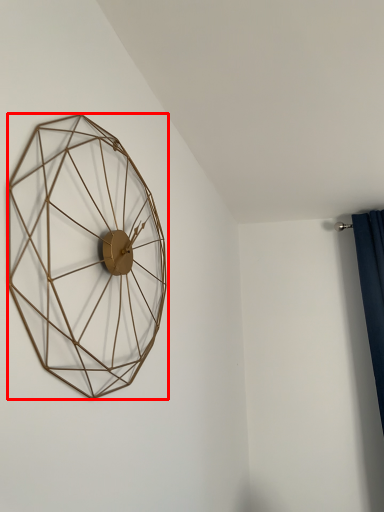
Question: From the image's perspective, considering the relative positions of wall clock (annotated by the red box) and curtain in the image provided, where is wall clock (annotated by the red box) located with respect to the staircase?

Choices:
 (A) below
 (B) above

Answer: (B)